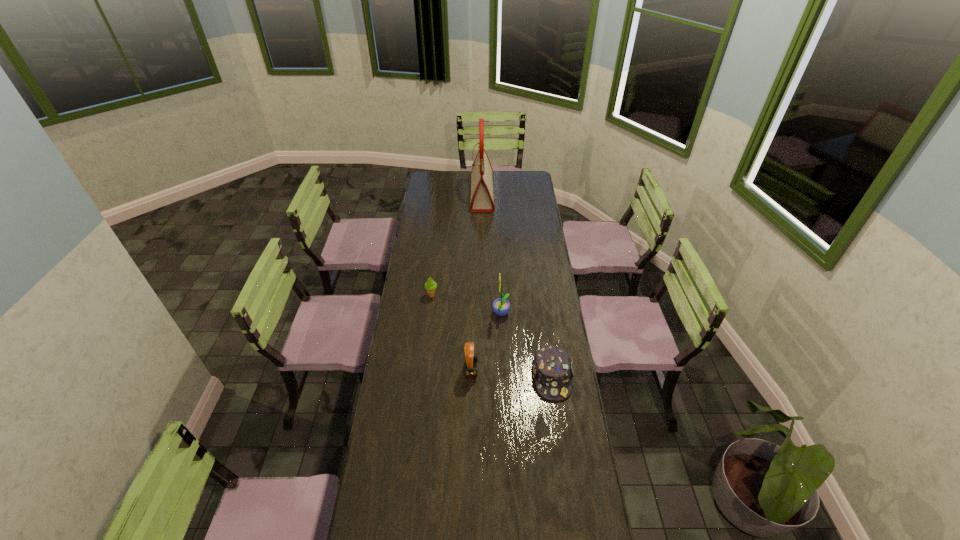
Where is `handbag`? handbag is located at coordinates (481, 201).

Locate an element on the screen. The height and width of the screenshot is (540, 960). the tallest object is located at coordinates (481, 201).

I want to click on the second tallest object, so click(501, 306).

Find the location of a particular element. sunflower is located at coordinates (501, 306).

Find the location of a particular element. headset is located at coordinates (471, 358).

The image size is (960, 540). I want to click on icecream, so click(x=430, y=285).

Identify the location of the leftmost object. (430, 285).

Find the location of a particular element. the shortest object is located at coordinates (552, 368).

What are the coordinates of `headwear` in the screenshot? It's located at (552, 368).

At what (x,y) coordinates should I click in order to perform the action: click on vacant area situated on the back of the farthest object. Please return your answer as a coordinate pair (x, y). The height and width of the screenshot is (540, 960). Looking at the image, I should click on (482, 173).